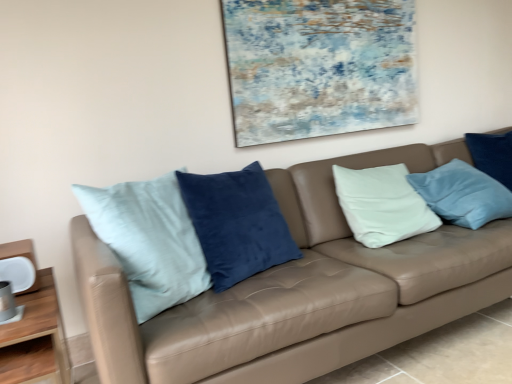
Where is `wooden table at lower left`? The image size is (512, 384). wooden table at lower left is located at coordinates (36, 339).

Image resolution: width=512 pixels, height=384 pixels. What do you see at coordinates (318, 67) in the screenshot? I see `textured canvas painting at upper center` at bounding box center [318, 67].

Describe the element at coordinates (492, 155) in the screenshot. The image size is (512, 384). I see `velvet blue pillow at right` at that location.

What is the approximate width of leather couch at center?

The width of leather couch at center is 5.38 feet.

What are the coordinates of `wooden table at lower left` in the screenshot? It's located at (36, 339).

In terms of height, does textured canvas painting at upper center look taller or shorter compared to leather couch at center?

Clearly, textured canvas painting at upper center is shorter compared to leather couch at center.

Looking at this image, from the image's perspective, is textured canvas painting at upper center located above or below leather couch at center?

textured canvas painting at upper center is situated higher than leather couch at center in the image.

Considering the points (357, 115) and (386, 275), which point is in front, point (357, 115) or point (386, 275)?

Point (386, 275)

From a real-world perspective, between wooden table at lower left and velvet blue pillow at right, who is vertically higher?

velvet blue pillow at right.

Are wooden table at lower left and velvet blue pillow at right beside each other?

No, wooden table at lower left is not beside velvet blue pillow at right.

Between wooden table at lower left and velvet blue pillow at right, which one has more height?

wooden table at lower left is taller.

From the image's perspective, is wooden table at lower left positioned above or below velvet blue pillow at right?

wooden table at lower left is below velvet blue pillow at right.

Is point (482, 135) closer or farther from the camera than point (42, 291)?

Point (482, 135) appears to be farther away from the viewer than point (42, 291).

Can you confirm if velvet blue pillow at right is bigger than wooden table at lower left?

Actually, velvet blue pillow at right might be smaller than wooden table at lower left.

Can we say velvet blue pillow at right lies outside wooden table at lower left?

velvet blue pillow at right lies outside wooden table at lower left's area.

Identify the location of pillow on the right of wooden table at lower left. This screenshot has height=384, width=512. (492, 155).

Considering their positions, is textured canvas painting at upper center located in front of or behind velvet blue pillow at right?

textured canvas painting at upper center is positioned closer to the viewer than velvet blue pillow at right.

From a real-world perspective, between textured canvas painting at upper center and velvet blue pillow at right, who is vertically higher?

textured canvas painting at upper center.

At what (x,y) coordinates should I click in order to perform the action: click on picture frame located above the velvet blue pillow at right (from the image's perspective). Please return your answer as a coordinate pair (x, y). The image size is (512, 384). Looking at the image, I should click on (318, 67).

Based on their positions, is textured canvas painting at upper center located to the left or right of velvet blue pillow at right?

From the image, it's evident that textured canvas painting at upper center is to the left of velvet blue pillow at right.

Is velvet blue pillow at right facing towards leather couch at center?

Yes.

Is velvet blue pillow at right outside of leather couch at center?

No, velvet blue pillow at right is inside or overlapping with leather couch at center.

Who is more distant, velvet blue pillow at right or leather couch at center?

velvet blue pillow at right is further from the camera.

Where is `table below the leather couch at center (from the image's perspective)`? The image size is (512, 384). table below the leather couch at center (from the image's perspective) is located at coordinates (36, 339).

Between leather couch at center and wooden table at lower left, which one has smaller width?

Thinner between the two is wooden table at lower left.

Is leather couch at center positioned with its back to wooden table at lower left?

That's not correct — leather couch at center is not looking away from wooden table at lower left.

Between leather couch at center and wooden table at lower left, which one appears on the left side from the viewer's perspective?

Positioned to the left is wooden table at lower left.

Find the location of a particular element. The image size is (512, 384). table below the textured canvas painting at upper center (from the image's perspective) is located at coordinates (36, 339).

Is textured canvas painting at upper center not inside wooden table at lower left?

That's correct, textured canvas painting at upper center is outside of wooden table at lower left.

Considering the positions of point (282, 124) and point (45, 303), is point (282, 124) closer or farther from the camera than point (45, 303)?

Point (282, 124) appears to be farther away from the viewer than point (45, 303).

Looking at the image, does textured canvas painting at upper center seem bigger or smaller compared to wooden table at lower left?

Considering their sizes, textured canvas painting at upper center takes up less space than wooden table at lower left.

Find the location of a particular element. picture frame above the leather couch at center (from a real-world perspective) is located at coordinates (318, 67).

The width and height of the screenshot is (512, 384). In order to click on pillow located above the wooden table at lower left (from the image's perspective) in this screenshot , I will do `click(492, 155)`.

Which object lies nearer to the anchor point velvet blue pillow at right, wooden table at lower left or leather couch at center?

leather couch at center lies closer to velvet blue pillow at right than the other object.

Which object lies nearer to the anchor point velvet blue pillow at right, leather couch at center or wooden table at lower left?

The object closer to velvet blue pillow at right is leather couch at center.

When comparing their distances from velvet blue pillow at right, does leather couch at center or textured canvas painting at upper center seem closer?

textured canvas painting at upper center lies closer to velvet blue pillow at right than the other object.

Which object lies nearer to the anchor point leather couch at center, velvet blue pillow at right or textured canvas painting at upper center?

Based on the image, textured canvas painting at upper center appears to be nearer to leather couch at center.

Based on the photo, estimate the real-world distances between objects in this image. Which object is further from wooden table at lower left, leather couch at center or velvet blue pillow at right?

velvet blue pillow at right.

Looking at this image, which object lies nearer to the anchor point wooden table at lower left, leather couch at center or textured canvas painting at upper center?

The object closer to wooden table at lower left is leather couch at center.

From the picture: Considering their positions, is textured canvas painting at upper center positioned further to leather couch at center than velvet blue pillow at right?

velvet blue pillow at right is further to leather couch at center.

In the scene shown: Based on their spatial positions, is textured canvas painting at upper center or leather couch at center closer to wooden table at lower left?

leather couch at center is positioned closer to the anchor wooden table at lower left.

This screenshot has width=512, height=384. In order to click on picture frame between wooden table at lower left and velvet blue pillow at right in the horizontal direction in this screenshot , I will do `click(318, 67)`.

What are the coordinates of `studio couch located between wooden table at lower left and velvet blue pillow at right in the left-right direction` in the screenshot? It's located at (300, 291).

Image resolution: width=512 pixels, height=384 pixels. In order to click on picture frame situated between wooden table at lower left and leather couch at center from left to right in this screenshot , I will do (318, 67).

This screenshot has width=512, height=384. Find the location of `picture frame positioned between leather couch at center and velvet blue pillow at right from near to far`. picture frame positioned between leather couch at center and velvet blue pillow at right from near to far is located at coordinates pyautogui.click(x=318, y=67).